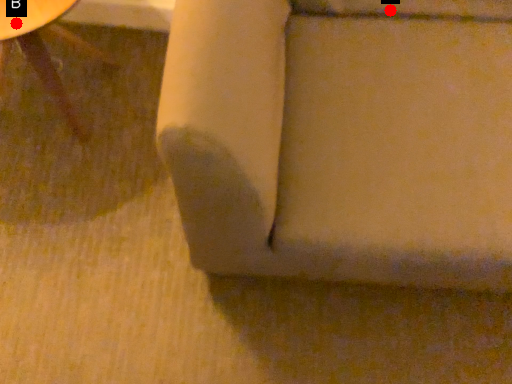
Question: Two points are circled on the image, labeled by A and B beside each circle. Among these points, which one is farthest from the camera?

Choices:
 (A) A is further
 (B) B is further

Answer: (A)